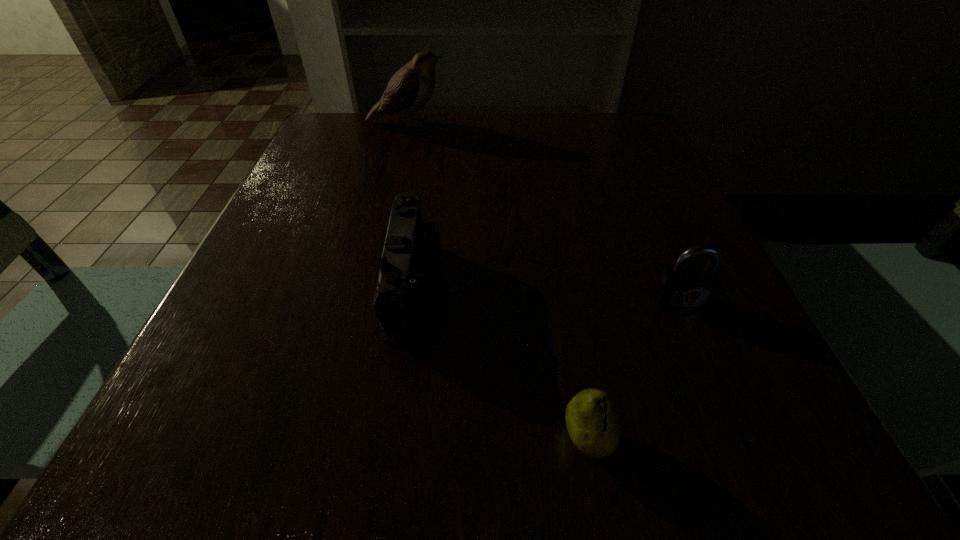
The height and width of the screenshot is (540, 960). Identify the location of vacant space at the near left corner of the desktop. (262, 435).

In the image, there is a desktop. Find the location of `vacant space at the far right corner`. vacant space at the far right corner is located at coordinates (612, 154).

In the image, there is a desktop. In order to click on free space at the near right corner in this screenshot , I will do `click(756, 478)`.

Where is `free point between the padlock and the nearest object`? This screenshot has height=540, width=960. free point between the padlock and the nearest object is located at coordinates (635, 371).

I want to click on blank region between the camcorder and the pear, so tap(500, 363).

This screenshot has width=960, height=540. I want to click on vacant space that is in between the padlock and the farthest object, so click(x=543, y=212).

Find the location of a particular element. The height and width of the screenshot is (540, 960). free space between the nearest object and the padlock is located at coordinates (635, 371).

Locate an element on the screen. The image size is (960, 540). free point between the farthest object and the nearest object is located at coordinates (497, 282).

What are the coordinates of `free spot between the padlock and the tallest object` in the screenshot? It's located at (543, 212).

Identify which object is located as the third nearest to the nearest object. Please provide its 2D coordinates. Your answer should be formatted as a tuple, i.e. [(x, y)], where the tuple contains the x and y coordinates of a point satisfying the conditions above.

[(410, 88)]